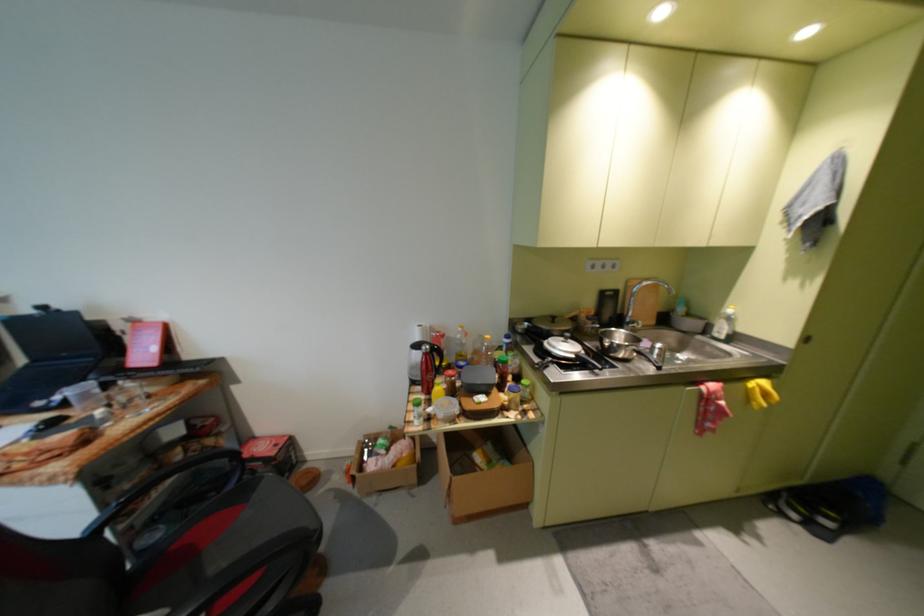
Find where to turn the metal faucet handle. Please return your answer as a coordinate pair (x, y).

(647, 302)